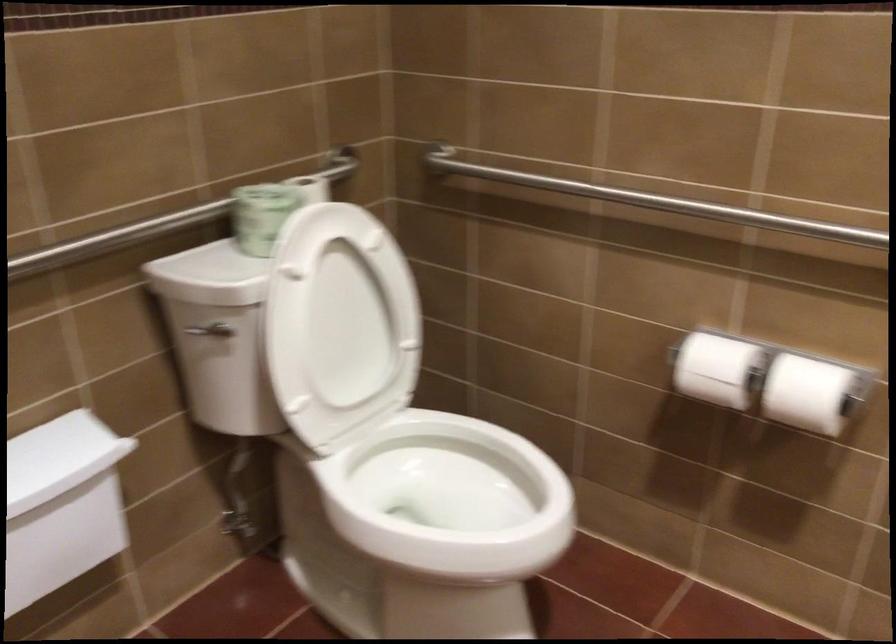
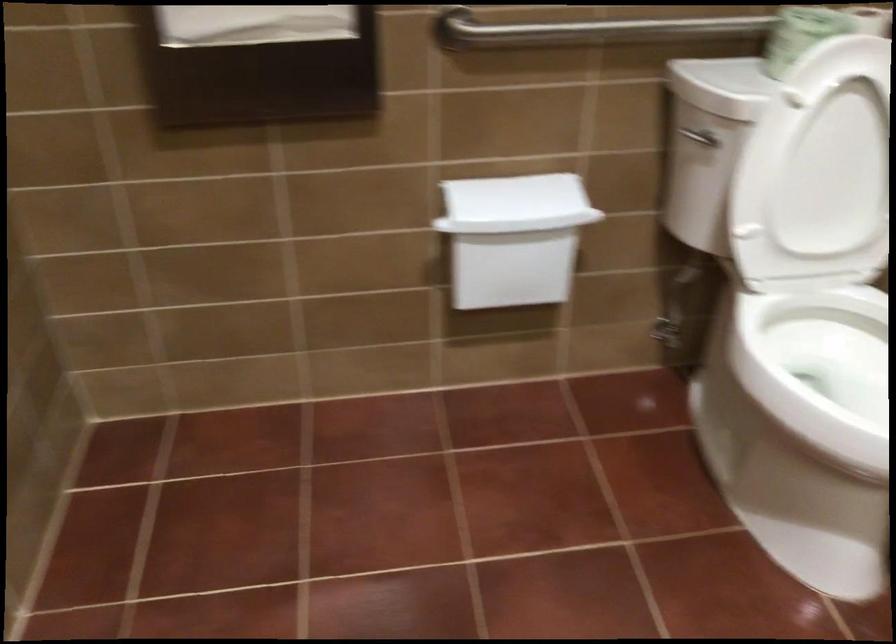
The first image is from the beginning of the video and the second image is from the end. How did the camera likely rotate when shooting the video?

The camera's rotation is toward left-down.